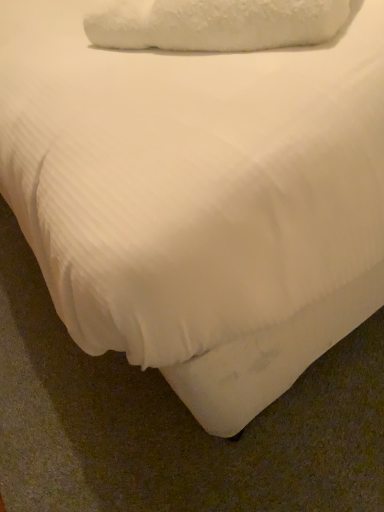
Describe the element at coordinates (216, 24) in the screenshot. This screenshot has width=384, height=512. I see `white fluffy pillow at upper center` at that location.

Locate an element on the screen. The width and height of the screenshot is (384, 512). white fluffy pillow at upper center is located at coordinates (216, 24).

Locate an element on the screen. The width and height of the screenshot is (384, 512). white fluffy pillow at upper center is located at coordinates (216, 24).